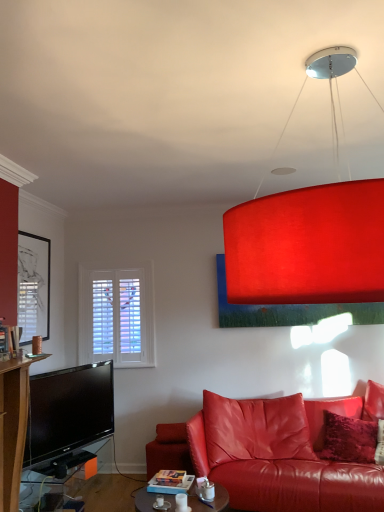
Find the location of a particular element. The image size is (384, 512). free space above matte red lampshade at upper center (from a real-world perspective) is located at coordinates (314, 57).